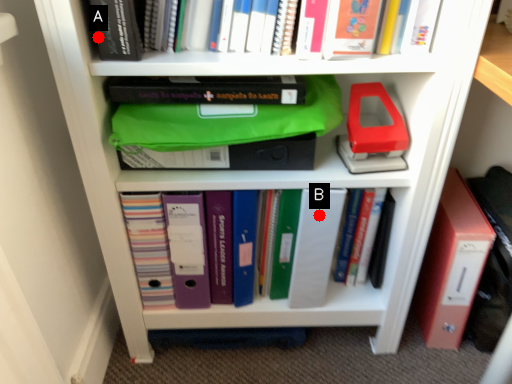
Question: Two points are circled on the image, labeled by A and B beside each circle. Which of the following is the closest to the observer?

Choices:
 (A) A is closer
 (B) B is closer

Answer: (A)